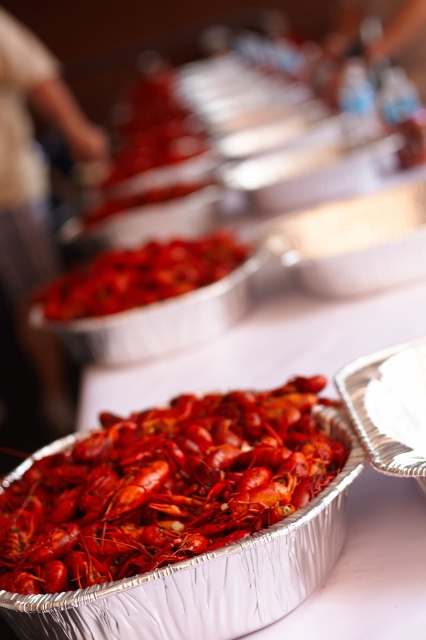
Question: Which point is closer to the camera?

Choices:
 (A) shiny red lobster at center
 (B) bright red crayfish at center

Answer: (A)

Question: Can you confirm if shiny red lobster at center is bigger than bright red crayfish at center?

Choices:
 (A) no
 (B) yes

Answer: (A)

Question: Which object is closer to the camera taking this photo?

Choices:
 (A) bright red crayfish at center
 (B) shiny red lobster at center

Answer: (B)

Question: Is shiny red lobster at center behind bright red crayfish at center?

Choices:
 (A) no
 (B) yes

Answer: (A)

Question: Is shiny red lobster at center thinner than bright red crayfish at center?

Choices:
 (A) yes
 (B) no

Answer: (A)

Question: Among these points, which one is farthest from the camera?

Choices:
 (A) (175, 268)
 (B) (124, 428)

Answer: (A)